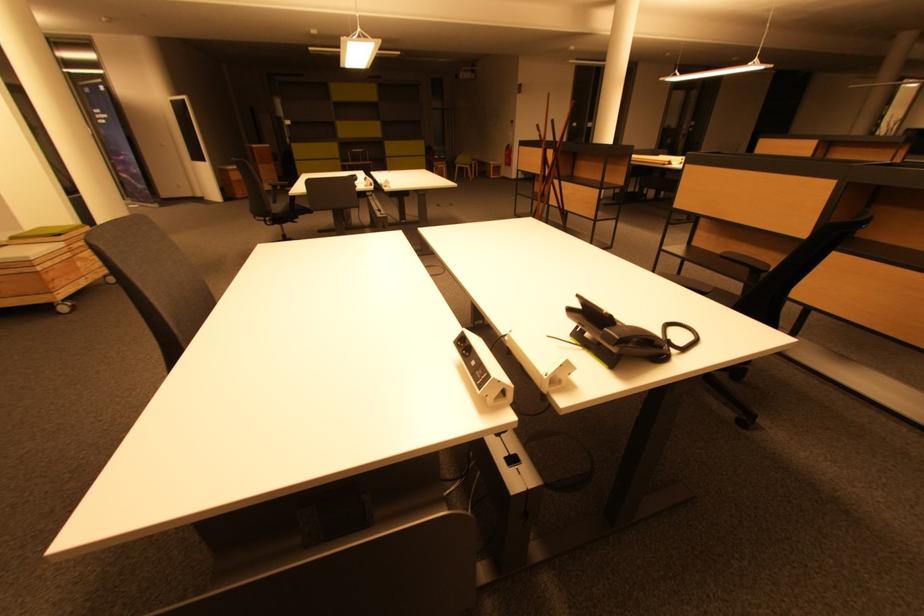
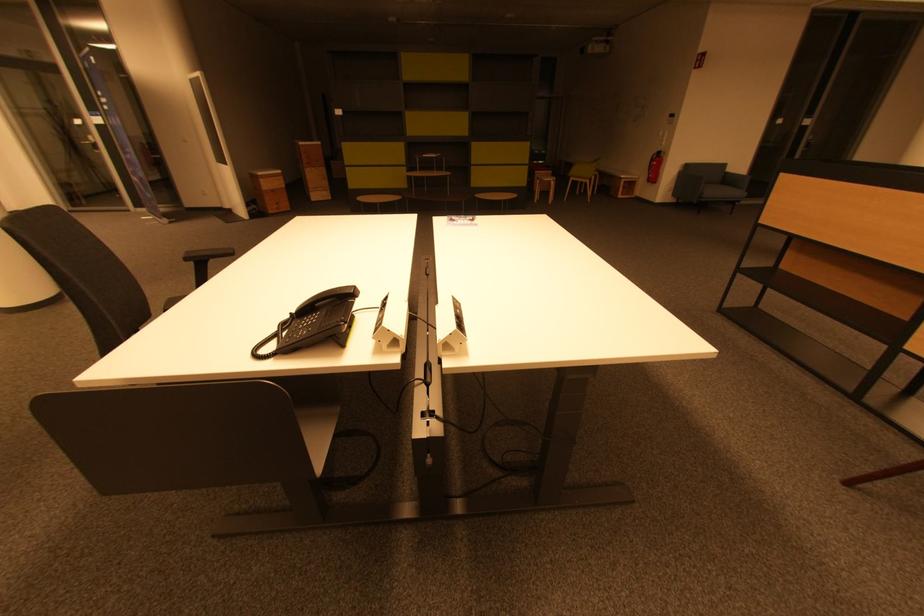
Question: In a continuous first-person perspective shot, in which direction is the camera moving?

Choices:
 (A) Left
 (B) Right
 (C) Forward
 (D) Backward

Answer: (C)